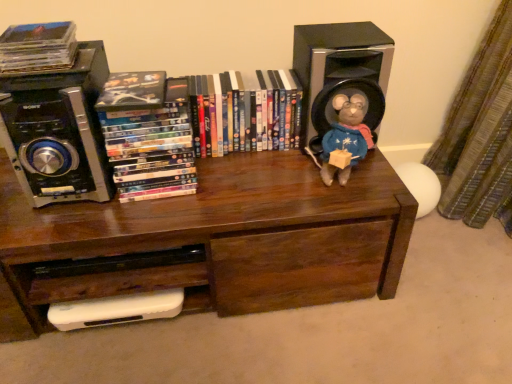
Locate an element on the screen. free space in front of fuzzy fabric stuffed animal at upper right is located at coordinates (344, 197).